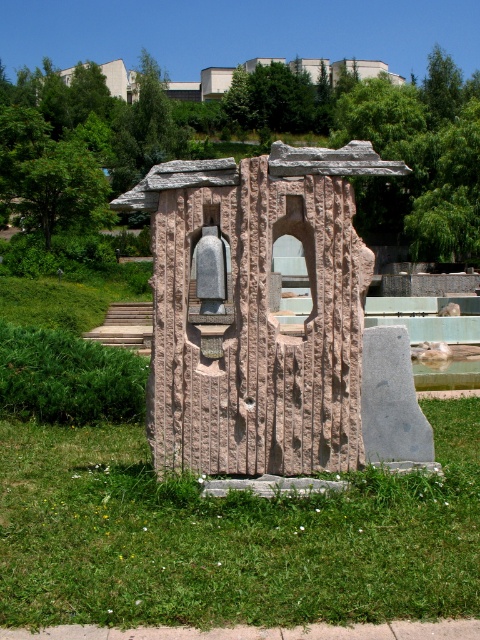
You are standing at the base of the large stone sculpture in the park. You notice a specific point marked at coordinates point (229, 536). What is located at this point?

The point (229, 536) marks green grass at center.

You are standing in the park and want to take a photo of the rough stone sculpture at center. However, there is green grass at center blocking your view. Can you see the sculpture through the grass?

The green grass at center is closer to the viewer than the rough stone sculpture at center, so the grass is blocking the view of the sculpture. You cannot see the sculpture through the grass.